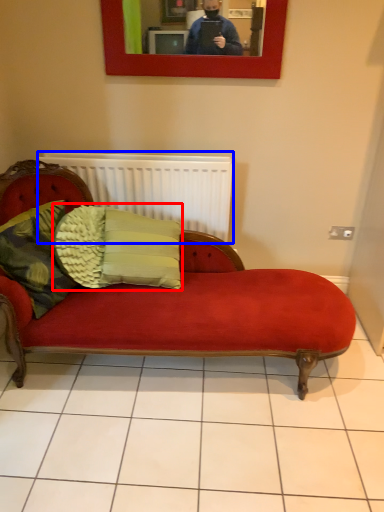
Question: Which object appears farthest to the camera in this image, pillow (highlighted by a red box) or radiator (highlighted by a blue box)?

Choices:
 (A) pillow
 (B) radiator

Answer: (B)